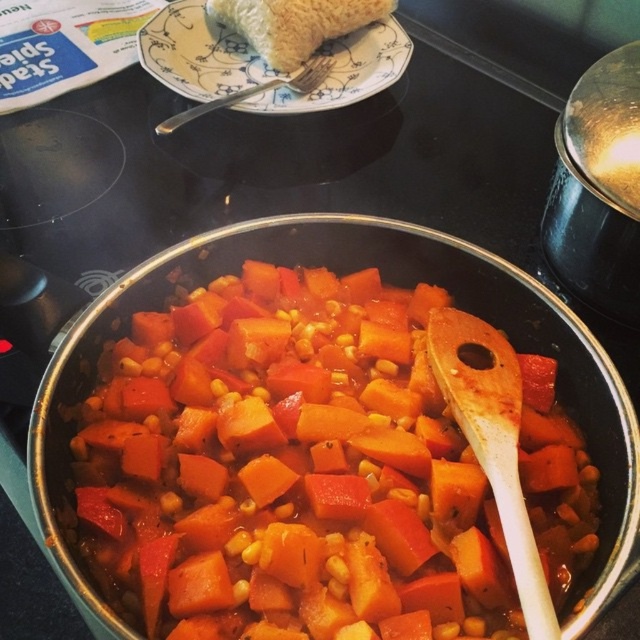
You are a chef preparing a meal and need to place the orange matte carrot at center onto the porcelain plate at upper center. Based on the scene description, will the carrot fit on the plate?

The orange matte carrot at center is larger in size than the porcelain plate at upper center, so it will not fit on the plate.